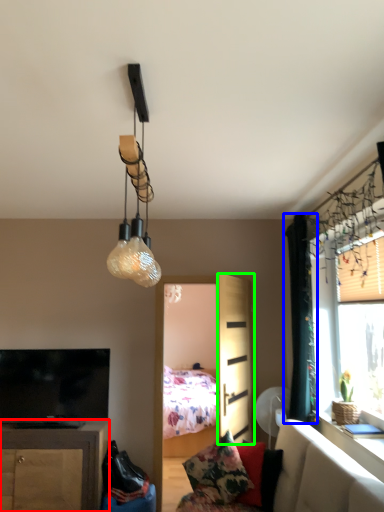
Question: Which object is positioned closest to cabinetry (highlighted by a red box)? Select from curtain (highlighted by a blue box) and screen door (highlighted by a green box).

Choices:
 (A) curtain
 (B) screen door

Answer: (B)